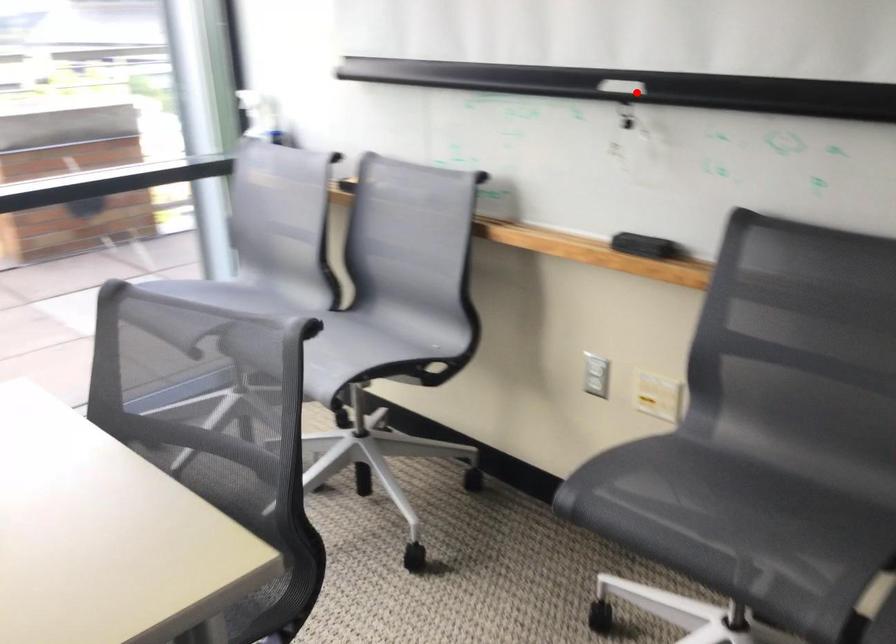
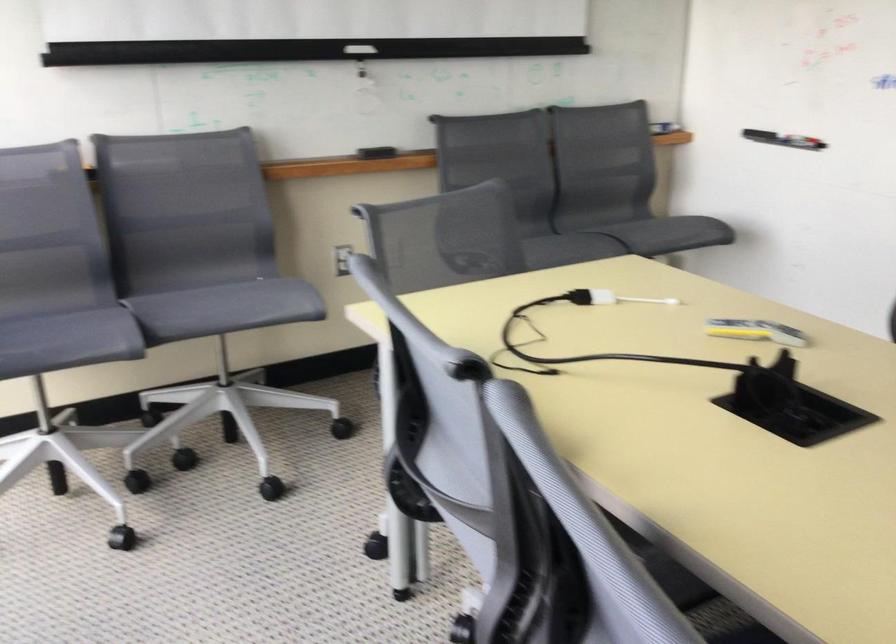
Question: I am providing you with two images of the same scene from different viewpoints. Image1 has a red point marked. In image2, the corresponding 3D location appears at what relative position? Reply with the corresponding letter.

Choices:
 (A) Closer
 (B) Farther

Answer: (B)